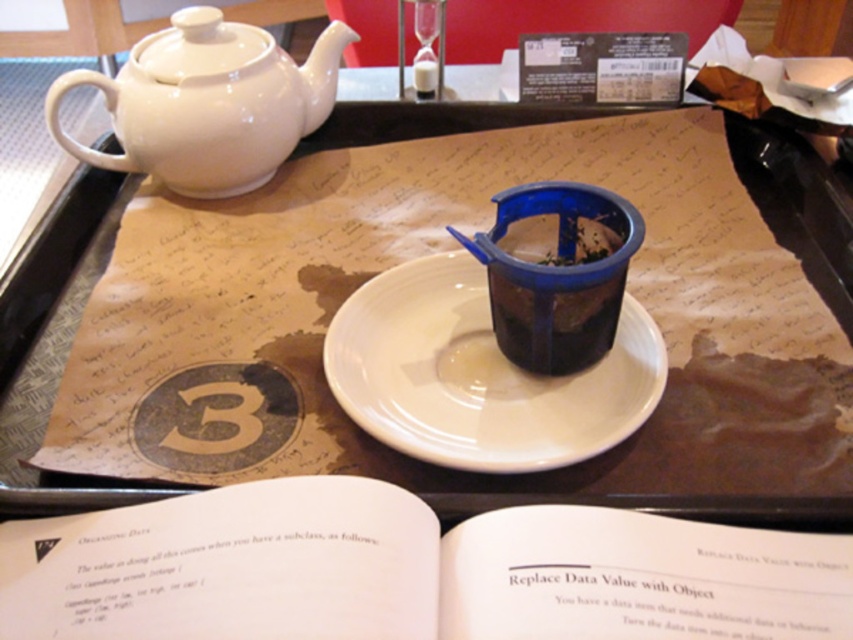
You are a guest at a tea ceremony and see the white paper book at center and the matte plastic cup at center on the tray. Which item is thinner?

The white paper book at center is thinner than the matte plastic cup at center.

You are setting up a tea service on a dark wooden tray. You have a matte plastic cup at center and a white ceramic saucer at center. Which item is taller?

The matte plastic cup at center is taller than the white ceramic saucer at center.

You are a guest at a tea ceremony and want to pick up the matte plastic cup at center to drink from it. Is the white ceramic saucer at center in the way of your hand reaching the cup?

The matte plastic cup at center is closer to the viewer than the white ceramic saucer at center, so the saucer is behind the cup and not blocking the way. You can reach the matte plastic cup at center without any obstruction.